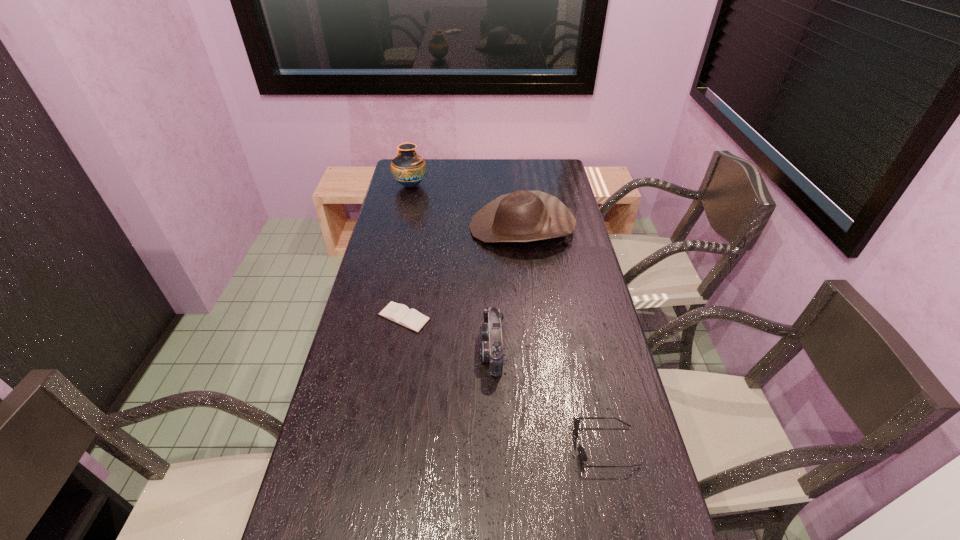
Find the location of a particular element. The image size is (960, 540). free space located 0.380m on the front-facing side of the third shortest object is located at coordinates (348, 349).

Find the location of a particular element. The height and width of the screenshot is (540, 960). vacant region located 0.290m on the front-facing side of the third shortest object is located at coordinates (379, 349).

Locate an element on the screen. free space located on the front-facing side of the third shortest object is located at coordinates (448, 349).

The image size is (960, 540). What are the coordinates of `blank space located on the front-facing side of the sunglasses` in the screenshot? It's located at (429, 446).

Where is `vacant space located on the front-facing side of the sunglasses`? The height and width of the screenshot is (540, 960). vacant space located on the front-facing side of the sunglasses is located at coordinates (450, 446).

Image resolution: width=960 pixels, height=540 pixels. Find the location of `vacant space situated on the front-facing side of the sunglasses`. vacant space situated on the front-facing side of the sunglasses is located at coordinates (434, 446).

You are a GUI agent. You are given a task and a screenshot of the screen. Output one action in this format:
    pyautogui.click(x=<x>, y=<y>)
    Task: Click on the vacant space located 0.270m on the front of the shortest object
    
    Given the screenshot: What is the action you would take?
    pyautogui.click(x=387, y=415)

What are the coordinates of `object that is at the far edge` in the screenshot? It's located at (408, 168).

You are a GUI agent. You are given a task and a screenshot of the screen. Output one action in this format:
    pyautogui.click(x=<x>, y=<y>)
    Task: Click on the pottery that is at the left edge
    This screenshot has width=960, height=540.
    Given the screenshot: What is the action you would take?
    pyautogui.click(x=408, y=168)

This screenshot has width=960, height=540. Find the location of `diary at the left edge`. diary at the left edge is located at coordinates (400, 314).